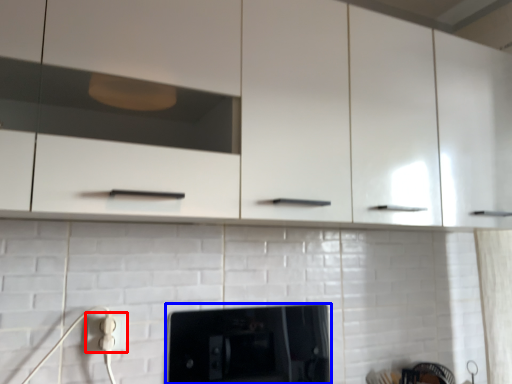
Question: Which of the following is the farthest to the observer, electric outlet (highlighted by a red box) or home appliance (highlighted by a blue box)?

Choices:
 (A) electric outlet
 (B) home appliance

Answer: (B)